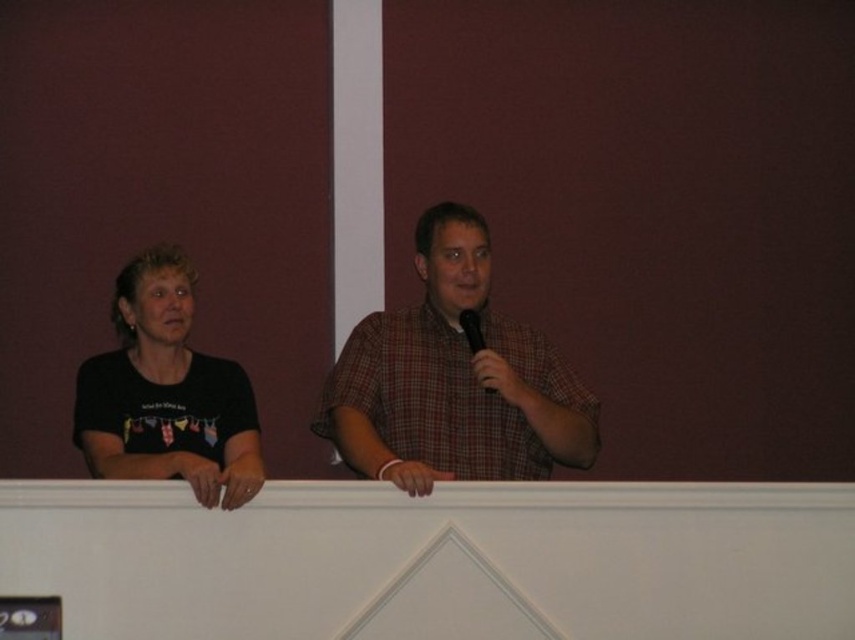
Measure the distance between plaid shirt at center and black t-shirt at left.

plaid shirt at center is 22.52 inches from black t-shirt at left.

Can you confirm if plaid shirt at center is taller than black t-shirt at left?

Yes, plaid shirt at center is taller than black t-shirt at left.

Is point (494, 376) positioned before point (146, 292)?

Yes.

Find the location of a particular element. This screenshot has height=640, width=855. plaid shirt at center is located at coordinates (453, 380).

Is plaid shirt at center below black plastic microphone at center?

Correct, plaid shirt at center is located below black plastic microphone at center.

Who is lower down, plaid shirt at center or black plastic microphone at center?

plaid shirt at center is lower down.

Between point (369, 433) and point (482, 342), which one is positioned behind?

Positioned behind is point (482, 342).

The height and width of the screenshot is (640, 855). I want to click on plaid shirt at center, so click(x=453, y=380).

Is black t-shirt at left above black plastic microphone at center?

Actually, black t-shirt at left is below black plastic microphone at center.

Between point (243, 448) and point (476, 330), which one is positioned in front?

Point (243, 448) is in front.

This screenshot has width=855, height=640. In order to click on black t-shirt at left in this screenshot , I will do `click(166, 394)`.